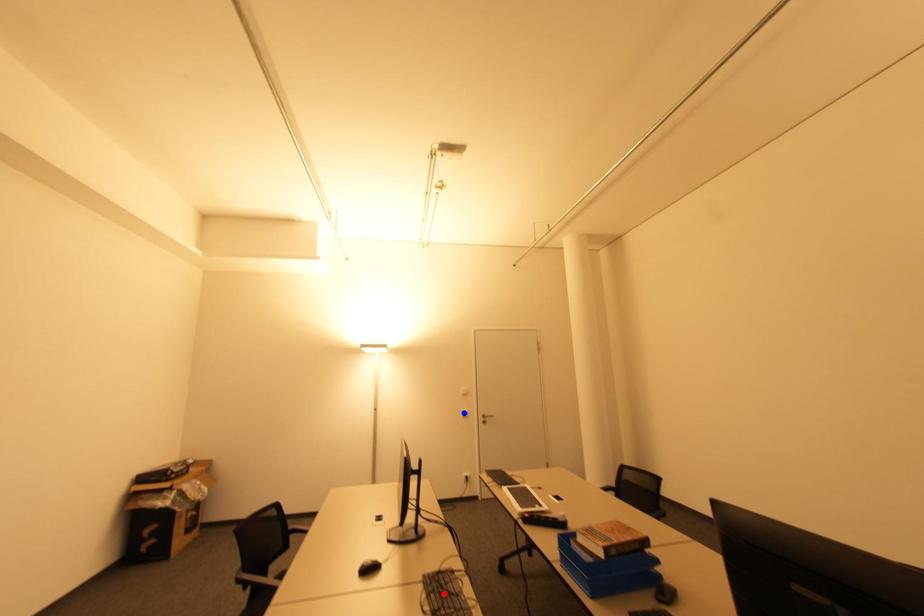
Question: Two points are marked on the image. Which point is closer to the camera?

Choices:
 (A) Blue point is closer.
 (B) Red point is closer.

Answer: (B)